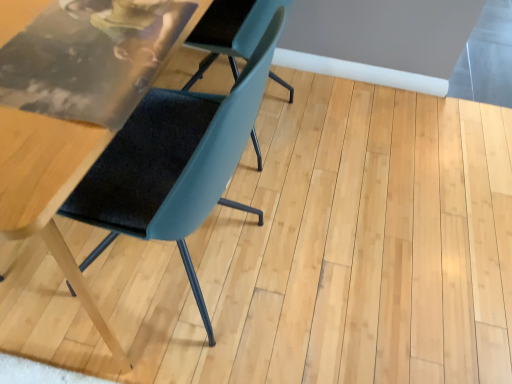
This screenshot has height=384, width=512. What do you see at coordinates (138, 165) in the screenshot? I see `teal fabric chair at center, the 2th chair viewed from the right` at bounding box center [138, 165].

In order to face teal fabric chair at center, which is counted as the first chair, starting from the left, should I rotate leftwards or rightwards?

It's best to rotate left around 21.329 degrees.

Identify the location of teal fabric chair at center, the 2th chair viewed from the right. This screenshot has height=384, width=512. (138, 165).

At what (x,y) coordinates should I click in order to perform the action: click on matte blue chair at center, positioned as the 1th chair in right-to-left order. Please return your answer as a coordinate pair (x, y). This screenshot has height=384, width=512. Looking at the image, I should click on (233, 31).

Describe the element at coordinates (233, 31) in the screenshot. I see `matte blue chair at center, which appears as the second chair when viewed from the left` at that location.

Measure the distance between matte blue chair at center, which appears as the second chair when viewed from the left, and camera.

A distance of 27.56 inches exists between matte blue chair at center, which appears as the second chair when viewed from the left, and camera.

Where is `teal fabric chair at center, which is counted as the first chair, starting from the left`? The height and width of the screenshot is (384, 512). teal fabric chair at center, which is counted as the first chair, starting from the left is located at coordinates (138, 165).

Considering the relative positions of matte blue chair at center, positioned as the 1th chair in right-to-left order, and teal fabric chair at center, the 2th chair viewed from the right, in the image provided, is matte blue chair at center, positioned as the 1th chair in right-to-left order, to the right of teal fabric chair at center, the 2th chair viewed from the right, from the viewer's perspective?

Yes.

Does matte blue chair at center, positioned as the 1th chair in right-to-left order, lie behind teal fabric chair at center, which is counted as the first chair, starting from the left?

Yes, matte blue chair at center, positioned as the 1th chair in right-to-left order, is further from the camera.

Does point (261, 0) appear closer or farther from the camera than point (215, 36)?

Point (261, 0) is positioned closer to the camera compared to point (215, 36).

From the image's perspective, is matte blue chair at center, positioned as the 1th chair in right-to-left order, located above teal fabric chair at center, the 2th chair viewed from the right?

Yes.

From a real-world perspective, which is physically below, matte blue chair at center, positioned as the 1th chair in right-to-left order, or teal fabric chair at center, which is counted as the first chair, starting from the left?

In real-world perspective, matte blue chair at center, positioned as the 1th chair in right-to-left order, is lower.

Which object is wider, matte blue chair at center, which appears as the second chair when viewed from the left, or teal fabric chair at center, the 2th chair viewed from the right?

teal fabric chair at center, the 2th chair viewed from the right.

Considering the sizes of objects matte blue chair at center, which appears as the second chair when viewed from the left, and teal fabric chair at center, the 2th chair viewed from the right, in the image provided, who is taller, matte blue chair at center, which appears as the second chair when viewed from the left, or teal fabric chair at center, the 2th chair viewed from the right,?

Standing taller between the two is teal fabric chair at center, the 2th chair viewed from the right.

Is matte blue chair at center, which appears as the second chair when viewed from the left, bigger than teal fabric chair at center, the 2th chair viewed from the right?

No.

From the picture: Could teal fabric chair at center, which is counted as the first chair, starting from the left, be considered to be inside matte blue chair at center, positioned as the 1th chair in right-to-left order?

Definitely not — teal fabric chair at center, which is counted as the first chair, starting from the left, is not inside matte blue chair at center, positioned as the 1th chair in right-to-left order.

Would you consider matte blue chair at center, which appears as the second chair when viewed from the left, to be distant from teal fabric chair at center, the 2th chair viewed from the right?

matte blue chair at center, which appears as the second chair when viewed from the left, is actually quite close to teal fabric chair at center, the 2th chair viewed from the right.

Based on the photo, is matte blue chair at center, positioned as the 1th chair in right-to-left order, oriented away from teal fabric chair at center, which is counted as the first chair, starting from the left?

Yes, matte blue chair at center, positioned as the 1th chair in right-to-left order, is positioned with its back facing teal fabric chair at center, which is counted as the first chair, starting from the left.

The image size is (512, 384). I want to click on chair on the right of teal fabric chair at center, which is counted as the first chair, starting from the left, so click(233, 31).

Considering the positions of objects teal fabric chair at center, which is counted as the first chair, starting from the left, and matte blue chair at center, which appears as the second chair when viewed from the left, in the image provided, who is more to the right, teal fabric chair at center, which is counted as the first chair, starting from the left, or matte blue chair at center, which appears as the second chair when viewed from the left,?

matte blue chair at center, which appears as the second chair when viewed from the left.

Between teal fabric chair at center, which is counted as the first chair, starting from the left, and matte blue chair at center, which appears as the second chair when viewed from the left, which one is positioned behind?

matte blue chair at center, which appears as the second chair when viewed from the left, is more distant.

Based on the photo, which point is more forward, [92,153] or [266,0]?

Point [92,153]

From the image's perspective, is teal fabric chair at center, the 2th chair viewed from the right, positioned above or below matte blue chair at center, positioned as the 1th chair in right-to-left order?

teal fabric chair at center, the 2th chair viewed from the right, is situated lower than matte blue chair at center, positioned as the 1th chair in right-to-left order, in the image.

From a real-world perspective, is teal fabric chair at center, which is counted as the first chair, starting from the left, positioned above or below matte blue chair at center, positioned as the 1th chair in right-to-left order?

Clearly, from a real-world perspective, teal fabric chair at center, which is counted as the first chair, starting from the left, is above matte blue chair at center, positioned as the 1th chair in right-to-left order.

Is teal fabric chair at center, the 2th chair viewed from the right, wider than matte blue chair at center, which appears as the second chair when viewed from the left?

Yes.

Is teal fabric chair at center, the 2th chair viewed from the right, shorter than matte blue chair at center, which appears as the second chair when viewed from the left?

No, teal fabric chair at center, the 2th chair viewed from the right, is not shorter than matte blue chair at center, which appears as the second chair when viewed from the left.

Looking at the image, does teal fabric chair at center, the 2th chair viewed from the right, seem bigger or smaller compared to matte blue chair at center, positioned as the 1th chair in right-to-left order?

In the image, teal fabric chair at center, the 2th chair viewed from the right, appears to be larger than matte blue chair at center, positioned as the 1th chair in right-to-left order.

Would you say teal fabric chair at center, which is counted as the first chair, starting from the left, is outside matte blue chair at center, which appears as the second chair when viewed from the left?

Yes.

Can you see teal fabric chair at center, the 2th chair viewed from the right, touching matte blue chair at center, which appears as the second chair when viewed from the left?

No, teal fabric chair at center, the 2th chair viewed from the right, is not with matte blue chair at center, which appears as the second chair when viewed from the left.

Does teal fabric chair at center, the 2th chair viewed from the right, turn towards matte blue chair at center, positioned as the 1th chair in right-to-left order?

Yes, teal fabric chair at center, the 2th chair viewed from the right, is aimed at matte blue chair at center, positioned as the 1th chair in right-to-left order.

What's the angular difference between teal fabric chair at center, the 2th chair viewed from the right, and matte blue chair at center, positioned as the 1th chair in right-to-left order,'s facing directions?

178 degrees separate the facing orientations of teal fabric chair at center, the 2th chair viewed from the right, and matte blue chair at center, positioned as the 1th chair in right-to-left order.

You are a GUI agent. You are given a task and a screenshot of the screen. Output one action in this format:
    pyautogui.click(x=<x>, y=<y>)
    Task: Click on the chair on the left of matte blue chair at center, which appears as the second chair when viewed from the left
    Image resolution: width=512 pixels, height=384 pixels.
    Given the screenshot: What is the action you would take?
    pyautogui.click(x=138, y=165)

What are the coordinates of `chair behind the teal fabric chair at center, which is counted as the first chair, starting from the left` in the screenshot? It's located at (233, 31).

Locate an element on the screen. chair that appears above the matte blue chair at center, positioned as the 1th chair in right-to-left order (from a real-world perspective) is located at coordinates (138, 165).